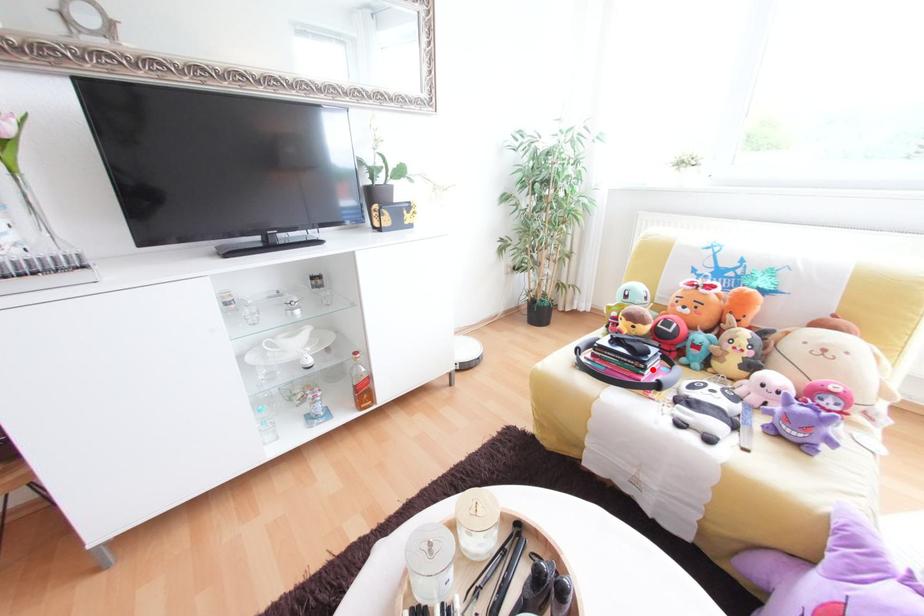
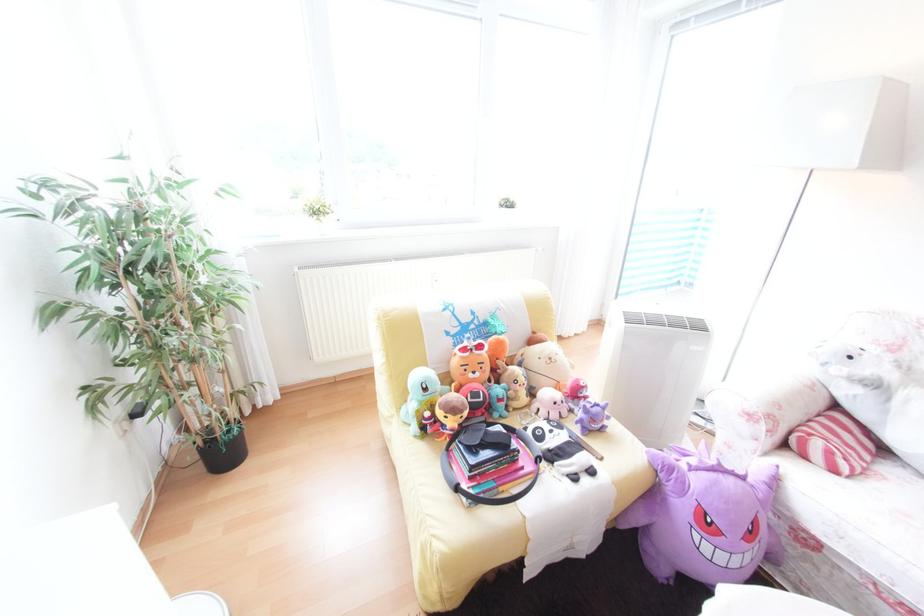
The point at the highlighted location is marked in the first image. Where is the corresponding point in the second image?

(526, 455)